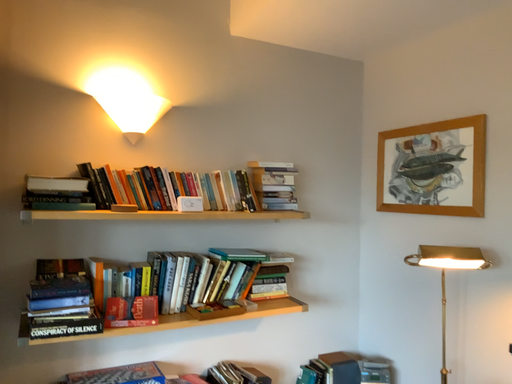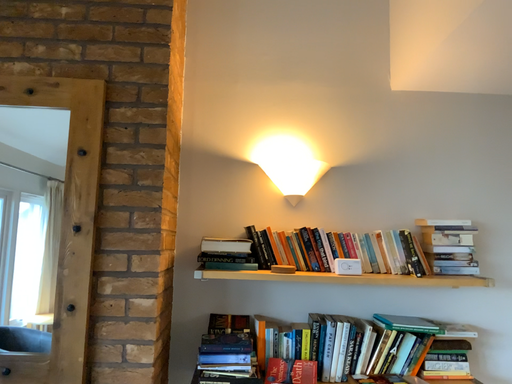
Question: Which way did the camera rotate in the video?

Choices:
 (A) rotated right
 (B) rotated left

Answer: (B)